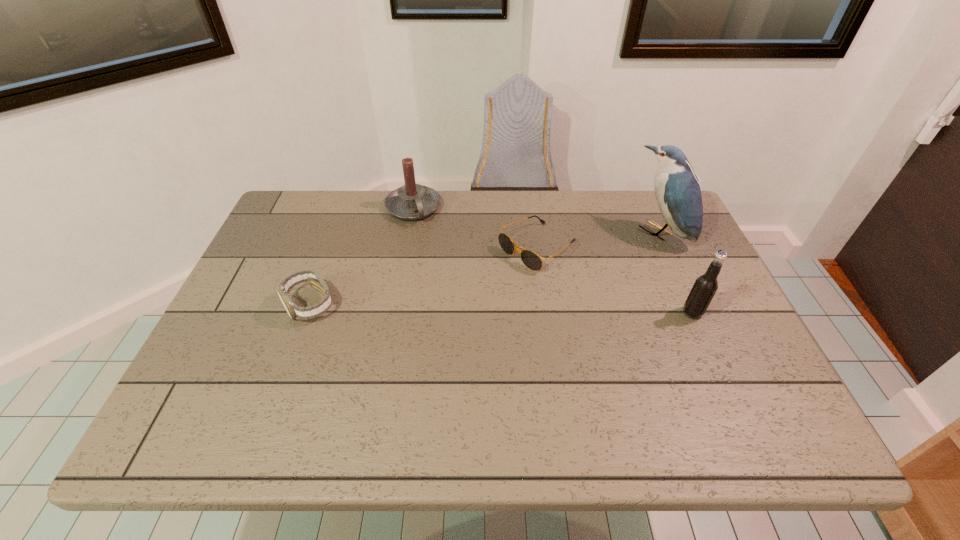
The height and width of the screenshot is (540, 960). What are the coordinates of `free space located on the front-facing side of the shortest object` in the screenshot? It's located at (399, 342).

Find the location of a particular element. The height and width of the screenshot is (540, 960). vacant space located 0.100m on the front-facing side of the shortest object is located at coordinates (484, 285).

I want to click on free space located on the side of the candle with the handle loop, so click(x=456, y=303).

Where is `vacant space located on the side of the candle with the handle loop`? vacant space located on the side of the candle with the handle loop is located at coordinates (458, 306).

Find the location of `vacant area located 0.360m on the side of the candle with the handle loop`. vacant area located 0.360m on the side of the candle with the handle loop is located at coordinates (461, 311).

Find the location of a particular element. This screenshot has height=540, width=960. vacant region located 0.250m at the tip of the tallest object's beak is located at coordinates (588, 287).

The height and width of the screenshot is (540, 960). What are the coordinates of `vacant area situated at the tip of the tallest object's beak` in the screenshot? It's located at (607, 273).

Locate an element on the screen. Image resolution: width=960 pixels, height=540 pixels. vacant space located at the tip of the tallest object's beak is located at coordinates (586, 289).

Locate an element on the screen. sunglasses located in the far edge section of the desktop is located at coordinates (530, 259).

The image size is (960, 540). Identify the location of candle situated at the far edge. (412, 201).